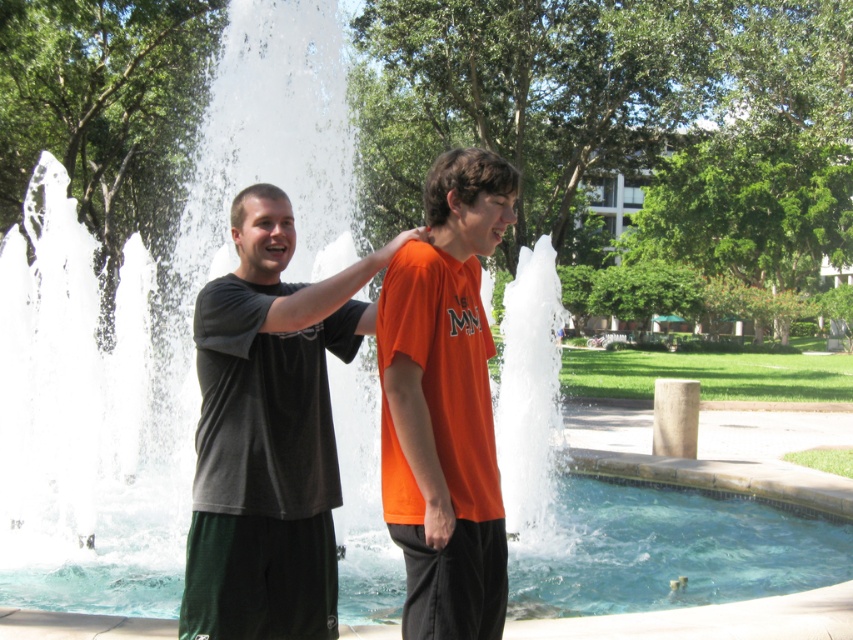
Is point (244, 636) farther from camera compared to point (421, 449)?

That is True.

Between point (227, 435) and point (476, 529), which one is positioned behind?

Positioned behind is point (227, 435).

Which is in front, point (267, 438) or point (422, 525)?

Point (422, 525) is in front.

I want to click on dark gray t-shirt at center, so click(270, 433).